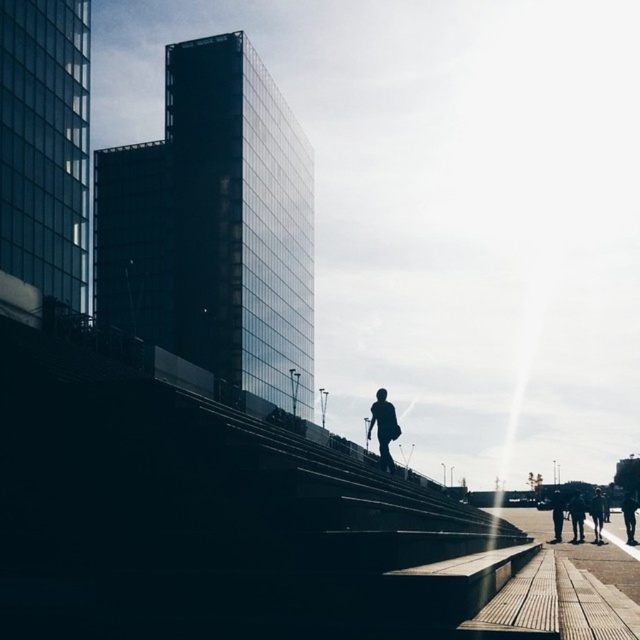
Question: Considering the relative positions of wooden planks at lower right and dark blue jeans at lower right in the image provided, where is wooden planks at lower right located with respect to dark blue jeans at lower right?

Choices:
 (A) below
 (B) above

Answer: (B)

Question: Based on their relative distances, which object is farther from the dark blue jeans at lower right?

Choices:
 (A) green fabric pants at lower right
 (B) wooden planks at lower right
 (C) silhouette figure at center
 (D) dark gray uniform at lower right

Answer: (C)

Question: Can you confirm if wooden planks at lower right is wider than dark blue jeans at lower right?

Choices:
 (A) yes
 (B) no

Answer: (B)

Question: Which point is farther to the camera?

Choices:
 (A) dark gray uniform at lower right
 (B) green fabric pants at lower right

Answer: (B)

Question: Does wooden planks at lower right appear on the right side of green fabric pants at lower right?

Choices:
 (A) no
 (B) yes

Answer: (A)

Question: Which of the following is the farthest from the observer?

Choices:
 (A) green fabric pants at lower right
 (B) dark gray uniform at lower right
 (C) silhouette figure at center
 (D) dark blue jeans at lower right

Answer: (D)